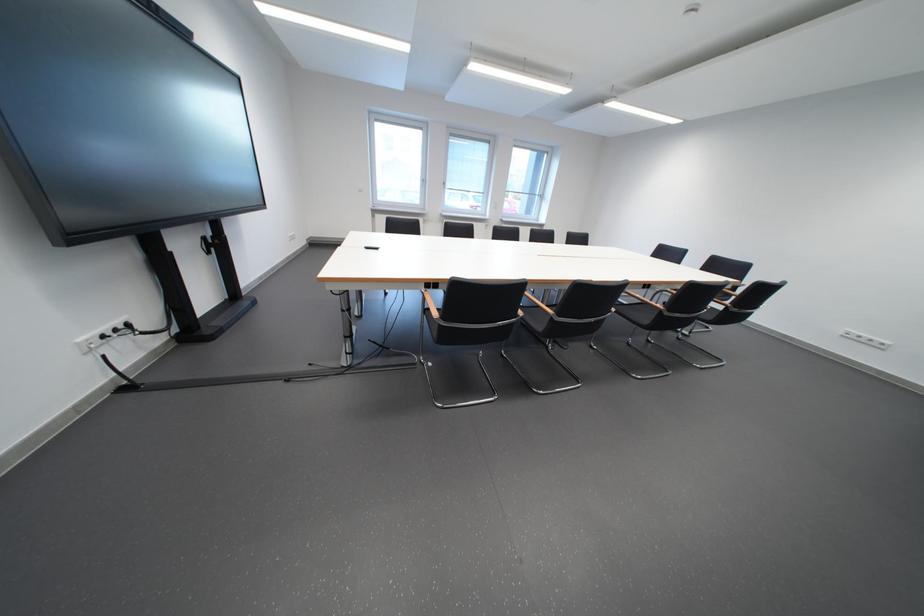
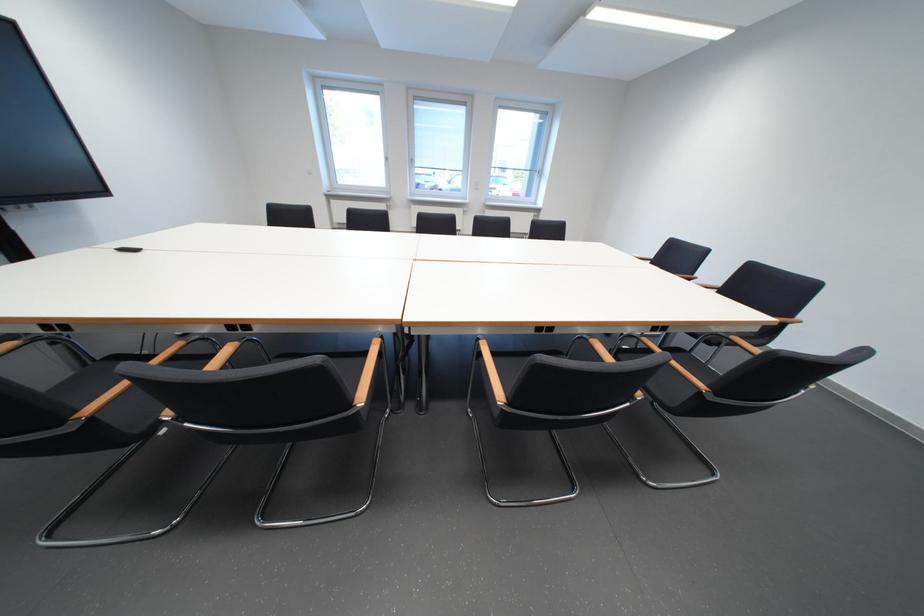
In a continuous first-person perspective shot, in which direction is the camera moving?

The cameraman moved toward right, forward.